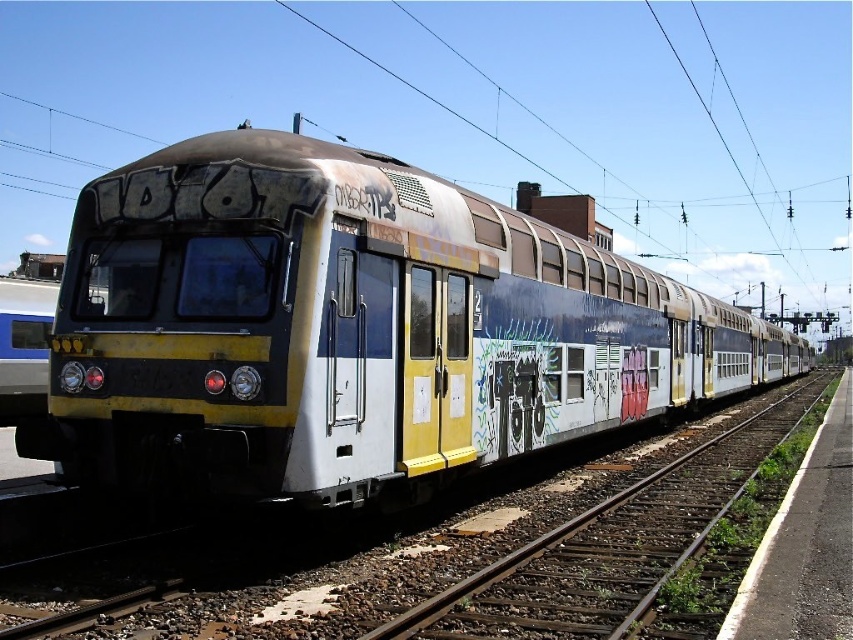
Question: Can you confirm if yellow matte train at center is bigger than smooth metal train track at center?

Choices:
 (A) yes
 (B) no

Answer: (A)

Question: Is yellow matte train at center below smooth metal train track at center?

Choices:
 (A) no
 (B) yes

Answer: (A)

Question: Is yellow matte train at center wider than smooth metal train track at center?

Choices:
 (A) no
 (B) yes

Answer: (B)

Question: Among these points, which one is nearest to the camera?

Choices:
 (A) (86, 349)
 (B) (607, 602)

Answer: (B)

Question: Which point is farther from the camera taking this photo?

Choices:
 (A) (341, 451)
 (B) (694, 500)

Answer: (B)